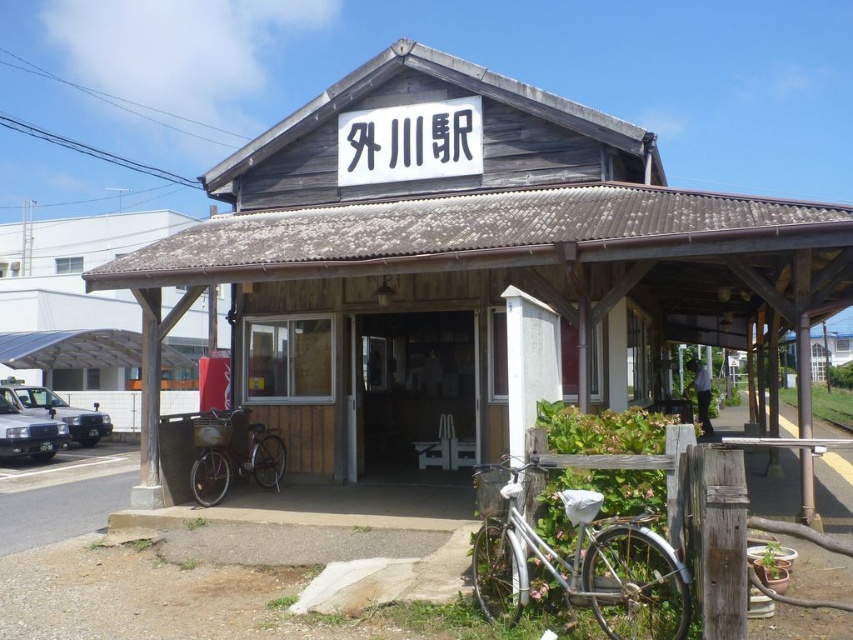
Is point (267, 252) farther from viewer compared to point (270, 468)?

That is False.

Is weathered wood hut at center smaller than silver metallic bicycle at center?

Incorrect, weathered wood hut at center is not smaller in size than silver metallic bicycle at center.

Which is behind, point (631, 193) or point (241, 472)?

The point (241, 472) is more distant.

Locate an element on the screen. The width and height of the screenshot is (853, 640). weathered wood hut at center is located at coordinates (463, 259).

Between point (329, 157) and point (103, 413), which one is positioned in front?

Positioned in front is point (329, 157).

Can you confirm if weathered wood hut at center is smaller than silver metallic car at left?

Actually, weathered wood hut at center might be larger than silver metallic car at left.

At what (x,y) coordinates should I click in order to perform the action: click on weathered wood hut at center. Please return your answer as a coordinate pair (x, y). Looking at the image, I should click on (463, 259).

Describe the element at coordinates (582, 564) in the screenshot. The height and width of the screenshot is (640, 853). I see `silver metallic bicycle at lower right` at that location.

Is silver metallic bicycle at lower right taller than silver metallic bicycle at center?

Yes.

Is point (639, 628) closer to viewer compared to point (223, 451)?

Yes, it is.

Where is `silver metallic bicycle at lower right`? This screenshot has width=853, height=640. silver metallic bicycle at lower right is located at coordinates (582, 564).